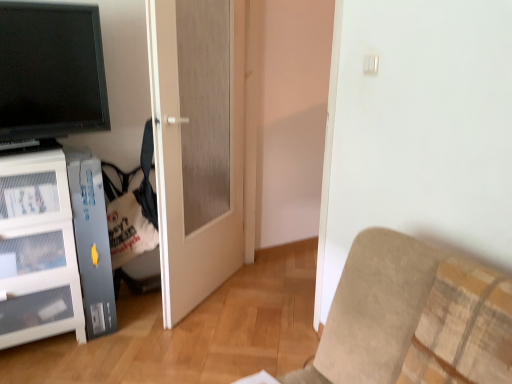
Question: Does point (60, 57) appear closer or farther from the camera than point (207, 38)?

Choices:
 (A) closer
 (B) farther

Answer: (A)

Question: Is matte black tv at upper left spatially inside matte white door at center, or outside of it?

Choices:
 (A) outside
 (B) inside

Answer: (A)

Question: Considering the real-world distances, which object is closest to the matte black tv at upper left?

Choices:
 (A) beige fabric couch at lower right
 (B) matte white door at center

Answer: (B)

Question: Based on their relative distances, which object is farther from the matte white door at center?

Choices:
 (A) matte black tv at upper left
 (B) beige fabric couch at lower right

Answer: (B)